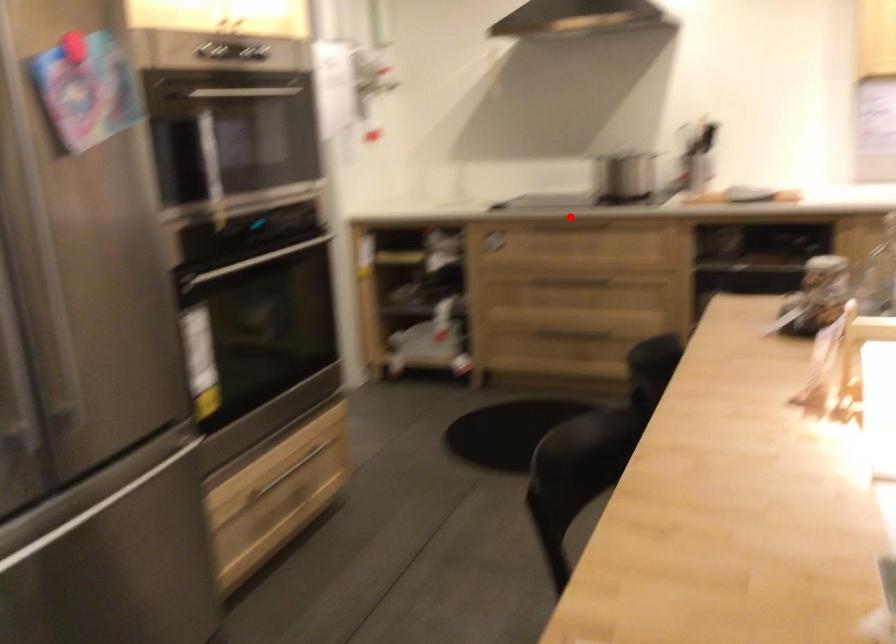
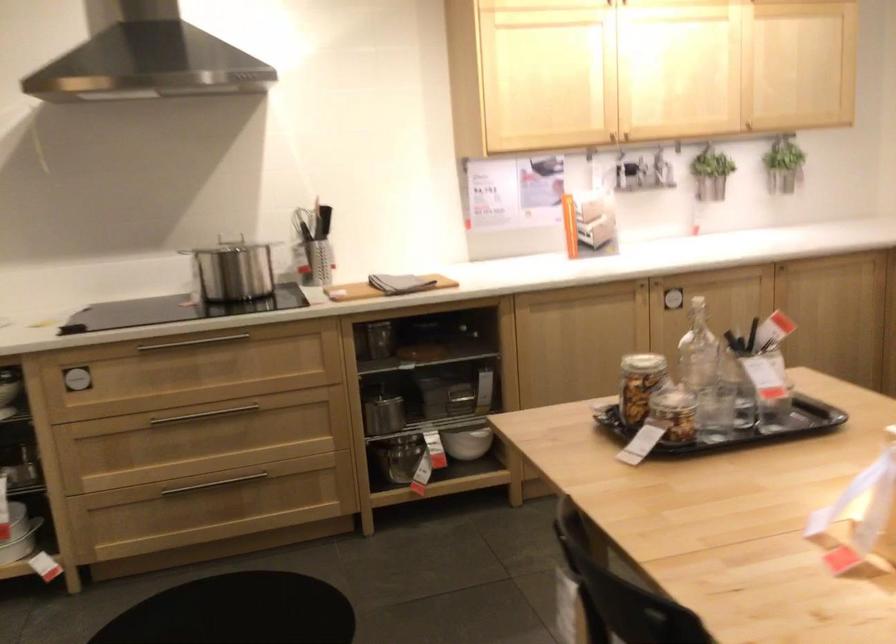
Question: I am providing you with two images of the same scene from different viewpoints. Given a red point in image1, look at the same physical point in image2. Is it:

Choices:
 (A) Closer to the viewpoint
 (B) Farther from the viewpoint

Answer: (A)